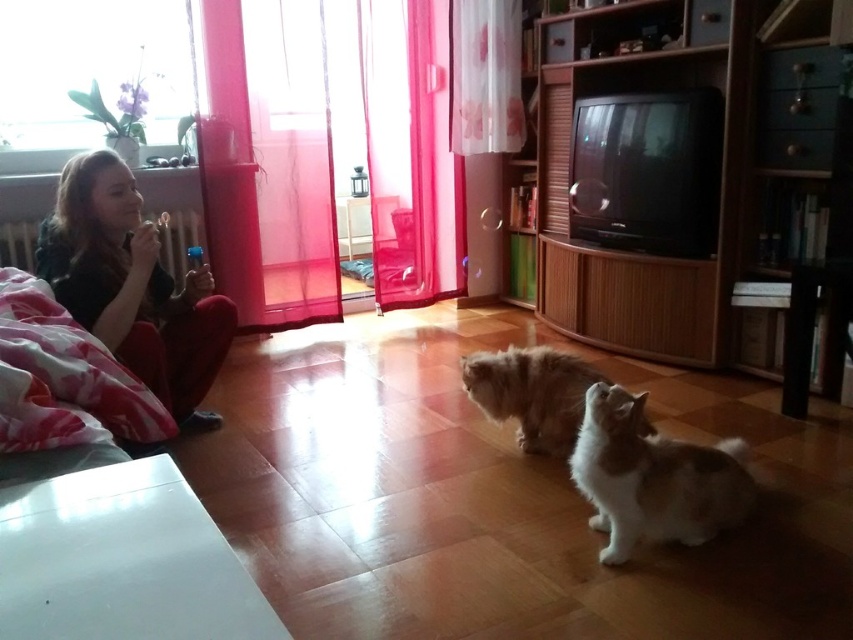
Consider the image. Which is more to the left, translucent floral-patterned curtain at upper center or fluffy brown cat at center?

translucent floral-patterned curtain at upper center is more to the left.

Between point (500, 120) and point (521, 400), which one is positioned behind?

The point (500, 120) is behind.

The image size is (853, 640). What are the coordinates of `translucent floral-patterned curtain at upper center` in the screenshot? It's located at (485, 76).

Can you confirm if matte black shirt at left is taller than fluffy brown cat at center?

Correct, matte black shirt at left is much taller as fluffy brown cat at center.

Can you confirm if matte black shirt at left is shorter than fluffy brown cat at center?

No.

Who is more forward, (200, 262) or (556, 444)?

Positioned in front is point (556, 444).

In order to click on matte black shirt at left in this screenshot , I will do `click(132, 285)`.

Is matte black shirt at left positioned at the back of translucent floral-patterned curtain at upper center?

No, it is in front of translucent floral-patterned curtain at upper center.

Who is more distant from viewer, (x=122, y=182) or (x=466, y=54)?

Point (x=466, y=54)

The height and width of the screenshot is (640, 853). What are the coordinates of `matte black shirt at left` in the screenshot? It's located at (132, 285).